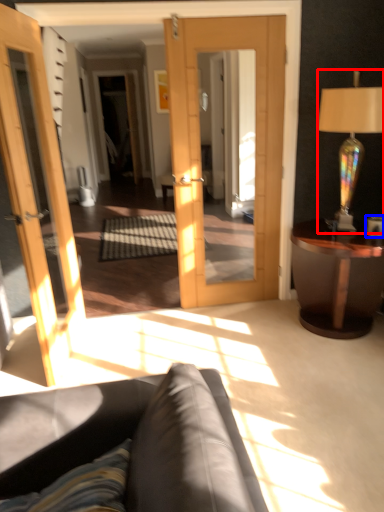
Question: Among these objects, which one is nearest to the camera, lamp (highlighted by a red box) or coffee cup (highlighted by a blue box)?

Choices:
 (A) lamp
 (B) coffee cup

Answer: (A)